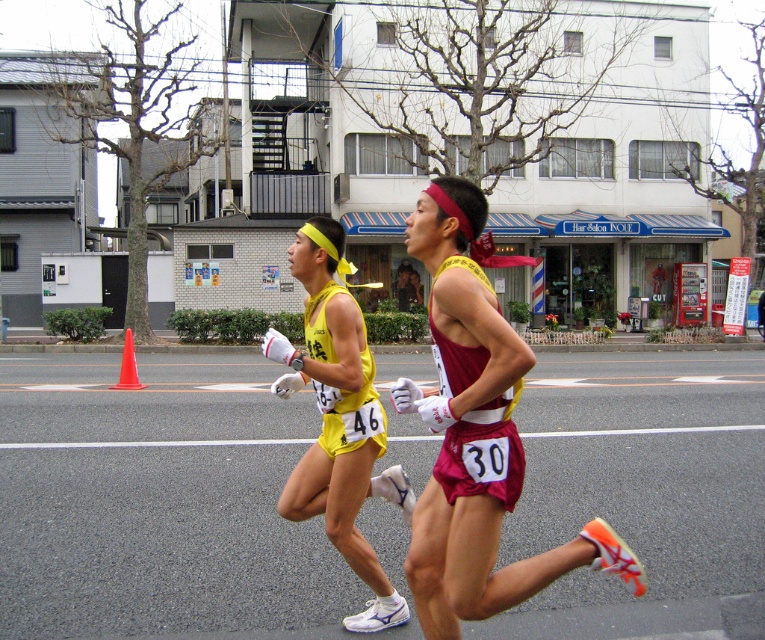
Question: Is yellow fabric shorts at center wider than orange plastic cone at left?

Choices:
 (A) yes
 (B) no

Answer: (B)

Question: Is yellow fabric shorts at center bigger than orange plastic cone at left?

Choices:
 (A) no
 (B) yes

Answer: (B)

Question: Which object appears farthest from the camera in this image?

Choices:
 (A) yellow fabric shorts at center
 (B) orange plastic cone at left

Answer: (B)

Question: Which object appears farthest from the camera in this image?

Choices:
 (A) orange plastic cone at left
 (B) yellow fabric shorts at center

Answer: (A)

Question: Is yellow fabric shorts at center smaller than orange plastic cone at left?

Choices:
 (A) no
 (B) yes

Answer: (A)